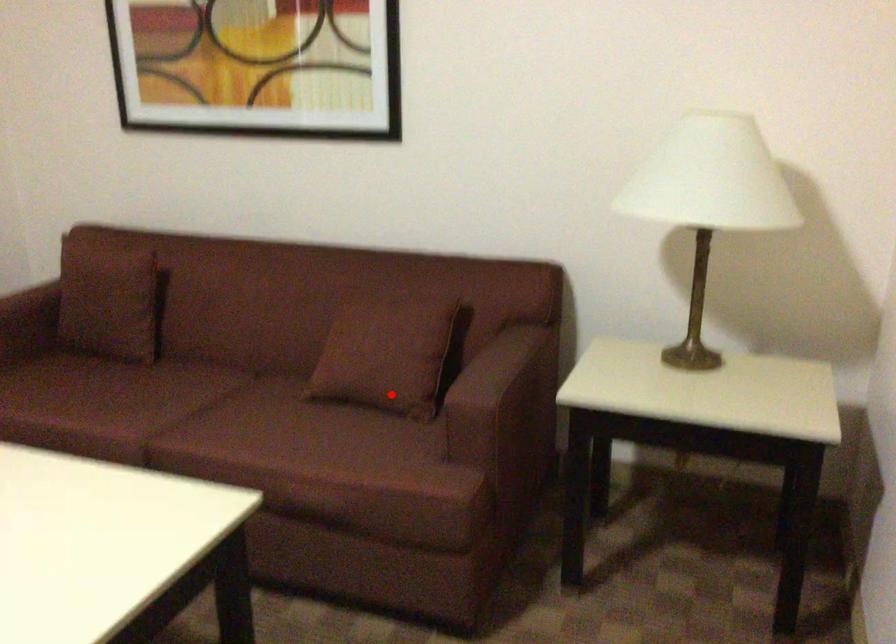
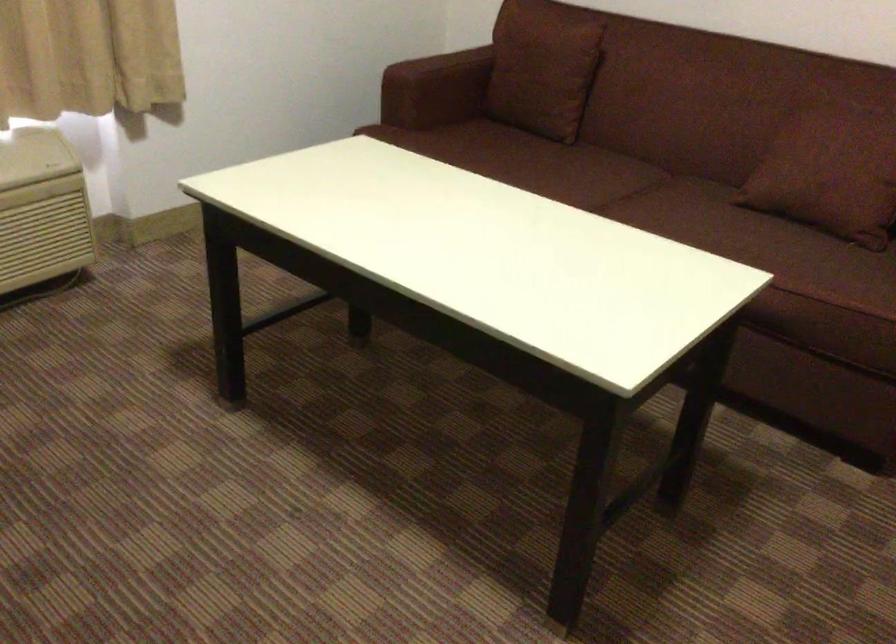
Question: A red point is marked in image1. In image2, is the corresponding 3D point closer to the camera or farther? Reply with the corresponding letter.

Choices:
 (A) The corresponding 3D point is closer.
 (B) The corresponding 3D point is farther.

Answer: (A)